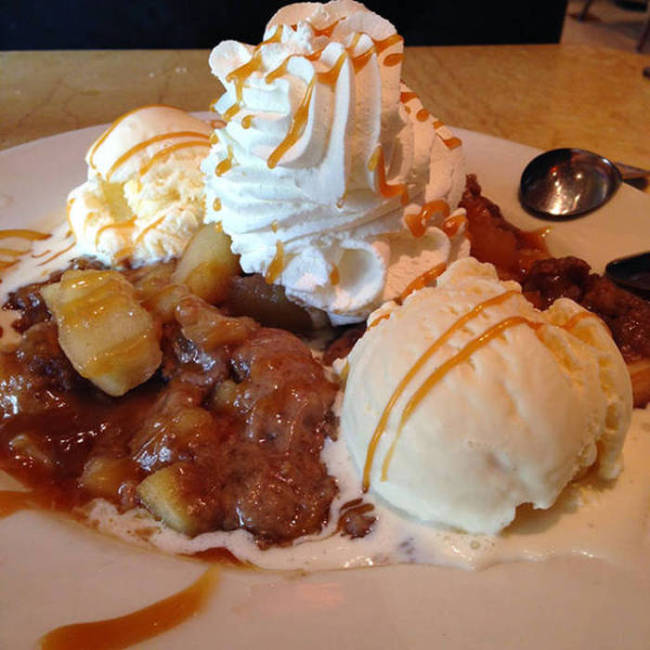
Locate an element on the screen. table is located at coordinates [528, 132].